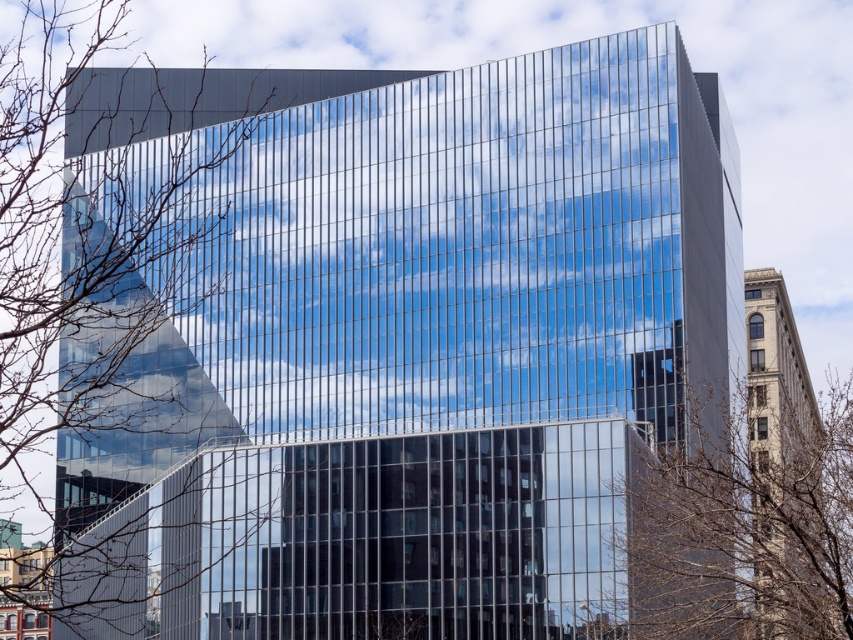
Can you confirm if bare branches at left is positioned to the left of brown leafless branches at center?

Indeed, bare branches at left is positioned on the left side of brown leafless branches at center.

Describe the element at coordinates (91, 273) in the screenshot. I see `bare branches at left` at that location.

Locate an element on the screen. The width and height of the screenshot is (853, 640). bare branches at left is located at coordinates (91, 273).